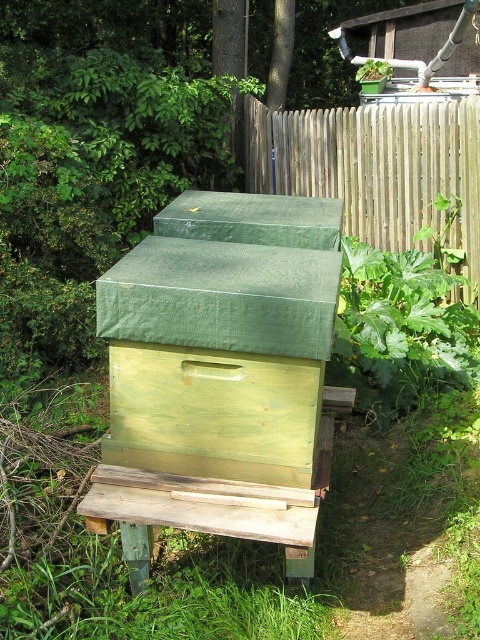
Question: Is green painted wood beehive at center bigger than wooden fence at upper center?

Choices:
 (A) no
 (B) yes

Answer: (A)

Question: Which point is farther to the camera?

Choices:
 (A) wooden fence at upper center
 (B) green painted wood beehive at center

Answer: (A)

Question: Does green painted wood beehive at center appear over wooden fence at upper center?

Choices:
 (A) no
 (B) yes

Answer: (A)

Question: Is green painted wood beehive at center to the right of wooden fence at upper center from the viewer's perspective?

Choices:
 (A) yes
 (B) no

Answer: (B)